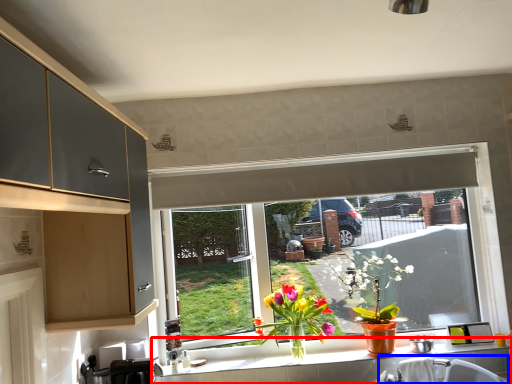
Question: Which object appears farthest to the camera in this image, countertop (highlighted by a red box) or sink (highlighted by a blue box)?

Choices:
 (A) countertop
 (B) sink

Answer: (A)